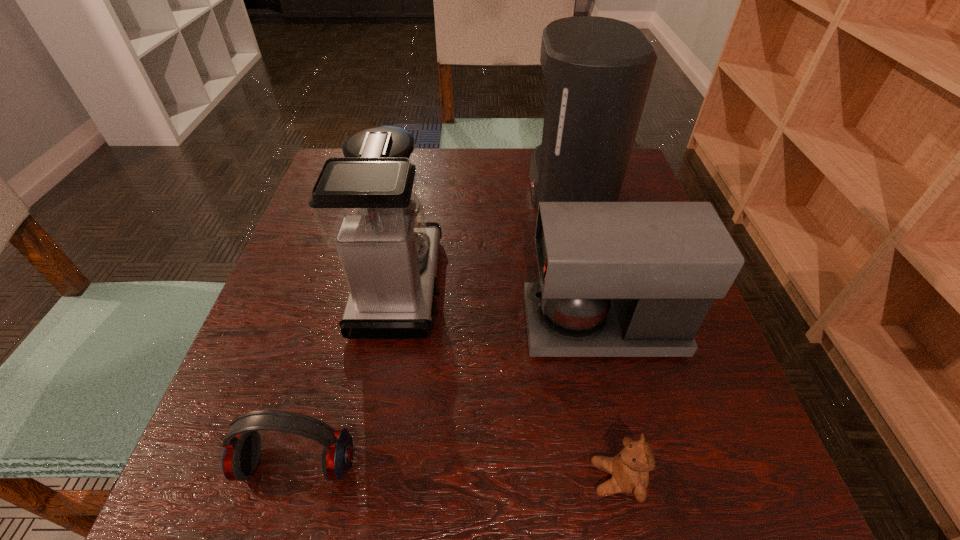
Where is `free spot that satisfies the following two spatial constraints: 1. on the button side of the farthest coffee maker; 2. on the ear cups of the fourth tallest object`? free spot that satisfies the following two spatial constraints: 1. on the button side of the farthest coffee maker; 2. on the ear cups of the fourth tallest object is located at coordinates (636, 464).

Identify the location of free space that satisfies the following two spatial constraints: 1. on the carafe side of the shortest coffee maker; 2. on the ear cups of the second shortest object. This screenshot has height=540, width=960. (636, 464).

Find the location of a particular element. The image size is (960, 540). vacant space that satisfies the following two spatial constraints: 1. at the front of the second tallest coffee maker where the controls are located; 2. on the ear cups of the earphone is located at coordinates (369, 464).

At what (x,y) coordinates should I click in order to perform the action: click on vacant point that satisfies the following two spatial constraints: 1. at the front of the second tallest object where the controls are located; 2. on the ear cups of the earphone. Please return your answer as a coordinate pair (x, y). This screenshot has height=540, width=960. Looking at the image, I should click on (369, 464).

You are a GUI agent. You are given a task and a screenshot of the screen. Output one action in this format:
    pyautogui.click(x=<x>, y=<y>)
    Task: Click on the vacant position in the image that satisfies the following two spatial constraints: 1. on the button side of the farthest coffee maker; 2. on the ear cups of the earphone
    This screenshot has width=960, height=540.
    Given the screenshot: What is the action you would take?
    pyautogui.click(x=636, y=464)